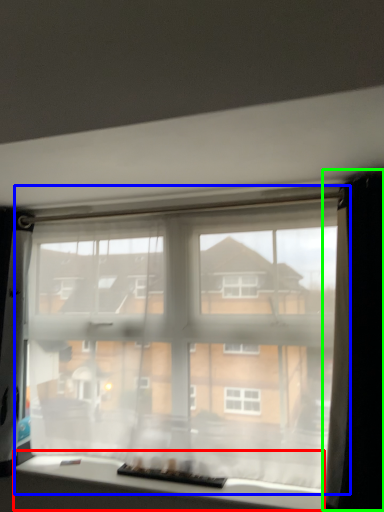
Question: Which is nearer to the window (highlighted by a red box)? window (highlighted by a blue box) or curtain (highlighted by a green box).

Choices:
 (A) window
 (B) curtain

Answer: (A)